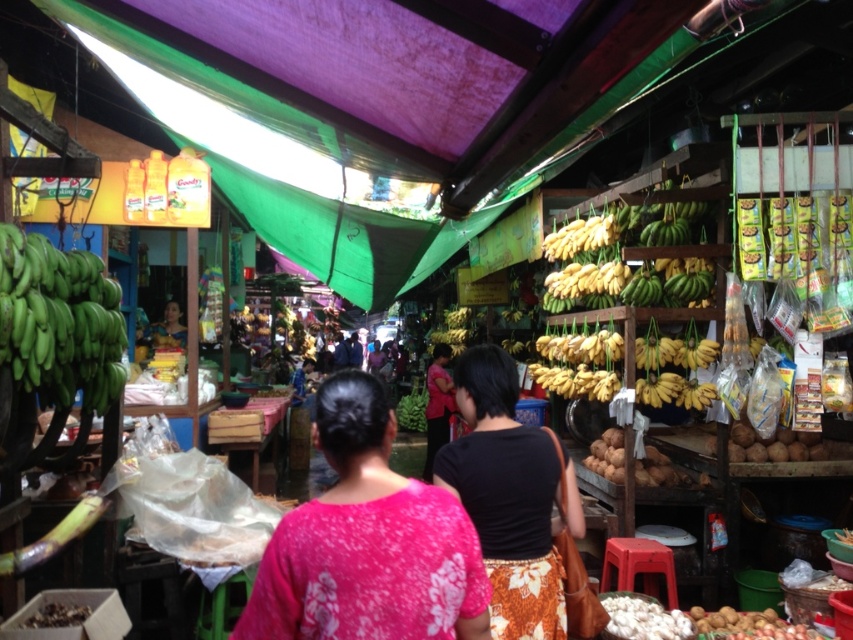
Question: Which point is closer to the camera?

Choices:
 (A) pink fabric shirt at center
 (B) black fabric shirt at center

Answer: (B)

Question: Which object is closer to the camera taking this photo?

Choices:
 (A) green matte bananas at left
 (B) pink floral blouse at center
 (C) matte black hair at center

Answer: (B)

Question: Based on their relative distances, which object is nearer to the pink floral blouse at center?

Choices:
 (A) black fabric shirt at center
 (B) pink fabric shirt at center
 (C) matte black hair at center

Answer: (A)

Question: Can you confirm if green matte bananas at left is smaller than pink fabric shirt at center?

Choices:
 (A) yes
 (B) no

Answer: (A)

Question: Does black fabric shirt at center appear under matte black hair at center?

Choices:
 (A) no
 (B) yes

Answer: (B)

Question: Can you confirm if pink fabric shirt at center is bigger than matte black hair at center?

Choices:
 (A) no
 (B) yes

Answer: (B)